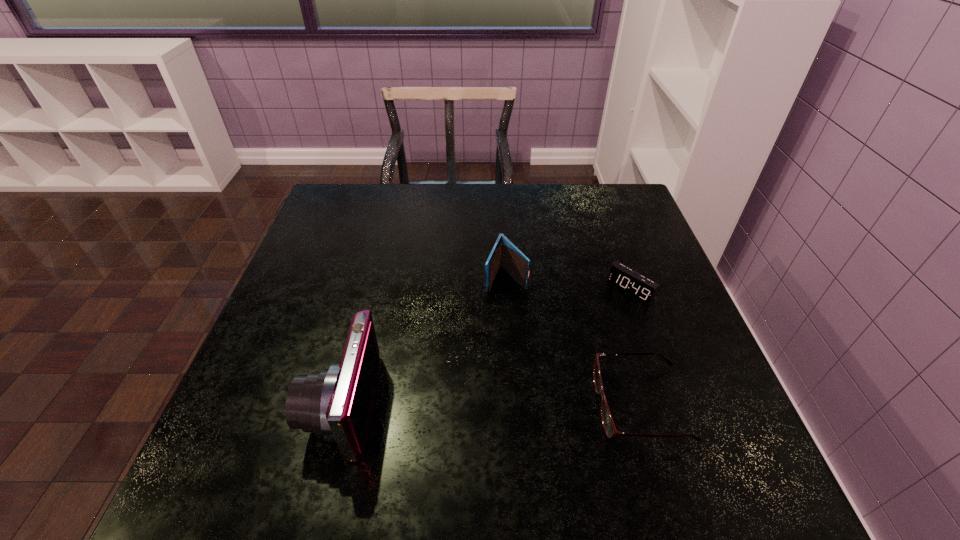
Identify the location of the tallest object. 335,403.

Identify the location of the leftmost object. The height and width of the screenshot is (540, 960). (335, 403).

Where is `spectacles`? This screenshot has height=540, width=960. spectacles is located at coordinates (607, 420).

Where is `the third tallest object`? the third tallest object is located at coordinates (634, 284).

This screenshot has height=540, width=960. I want to click on the second object from left to right, so click(x=504, y=253).

Find the location of `wallet`. wallet is located at coordinates (504, 253).

Locate an element on the screen. The height and width of the screenshot is (540, 960). vacant space located 0.060m on the front-facing side of the leftmost object is located at coordinates [x=283, y=404].

What are the coordinates of `vacant space located on the front-facing side of the leftmost object` in the screenshot? It's located at (252, 404).

The height and width of the screenshot is (540, 960). Find the location of `vacant space situated on the front-facing side of the leftmost object`. vacant space situated on the front-facing side of the leftmost object is located at coordinates (268, 404).

Image resolution: width=960 pixels, height=540 pixels. I want to click on vacant space located on the lenses of the spectacles, so click(x=535, y=404).